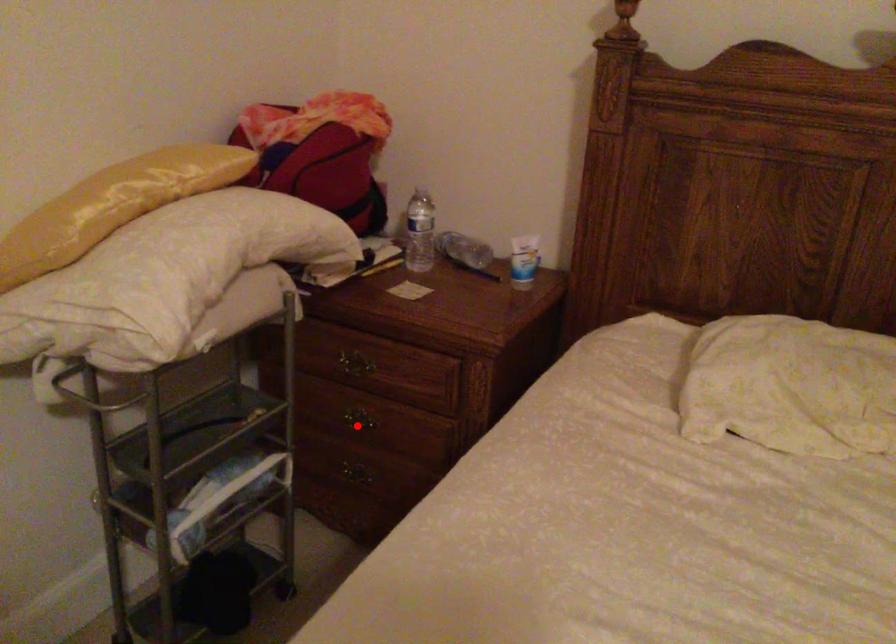
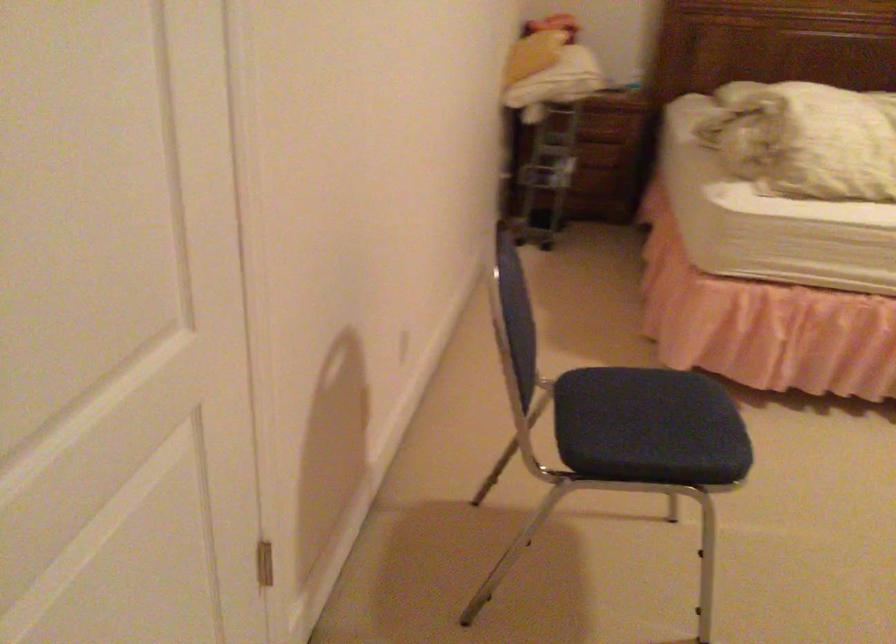
Question: I am providing you with two images of the same scene from different viewpoints. A red point is marked on the first image. Can you still see the location of the red point in image 2?

Choices:
 (A) Yes
 (B) No

Answer: (B)